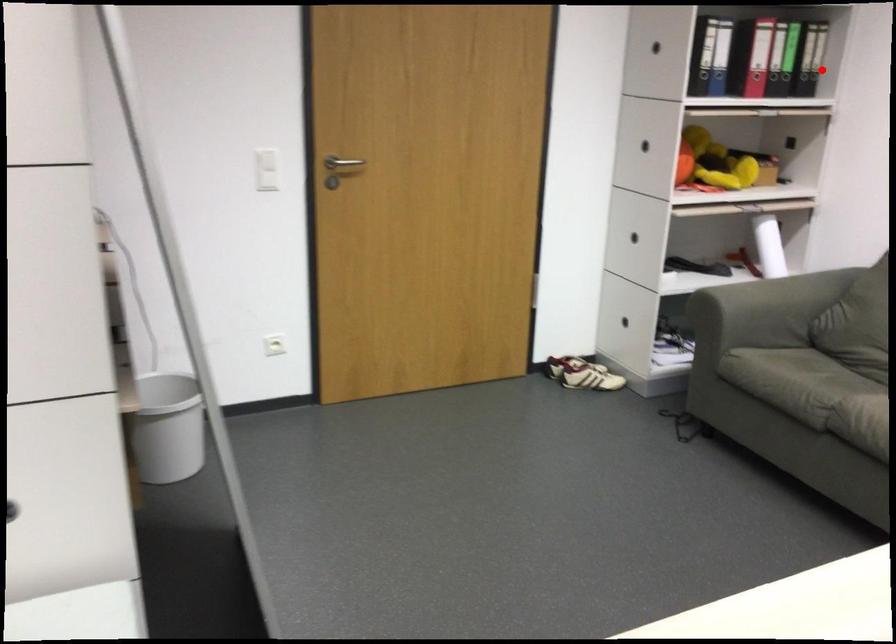
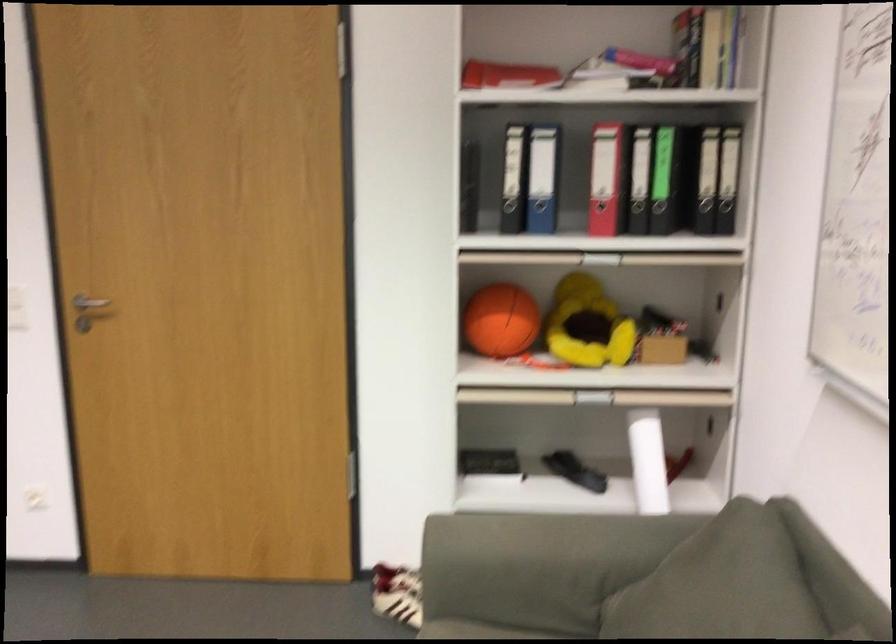
Question: I am providing you with two images of the same scene from different viewpoints. In image1, a red point is highlighted. Considering the same 3D point in image2, which of the following is correct?

Choices:
 (A) It is closer
 (B) It is farther

Answer: (A)